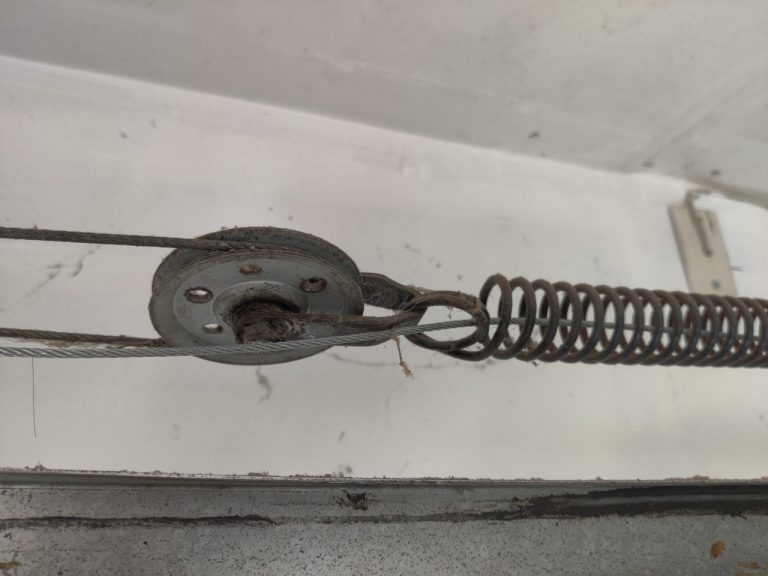
Find the location of a particular element. wall is located at coordinates (435, 228).